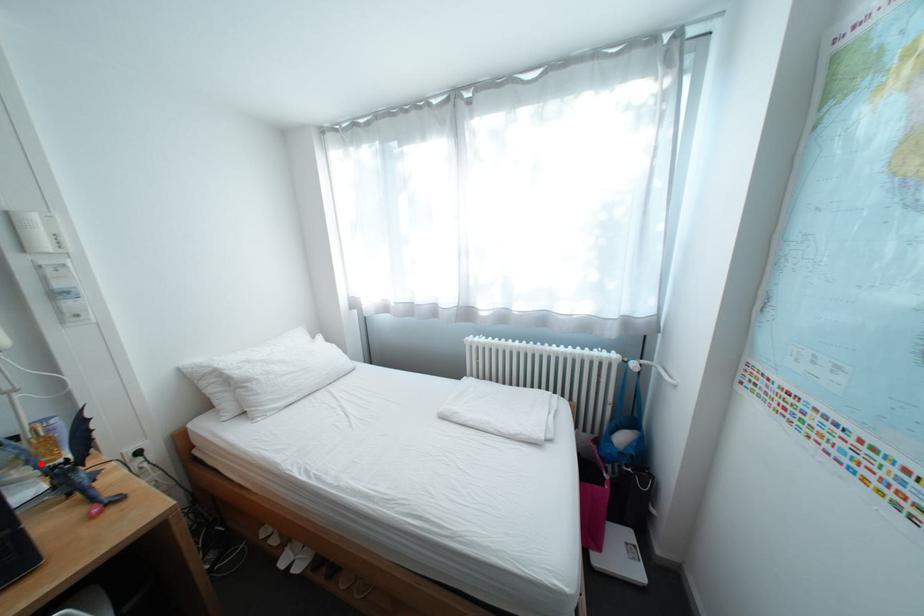
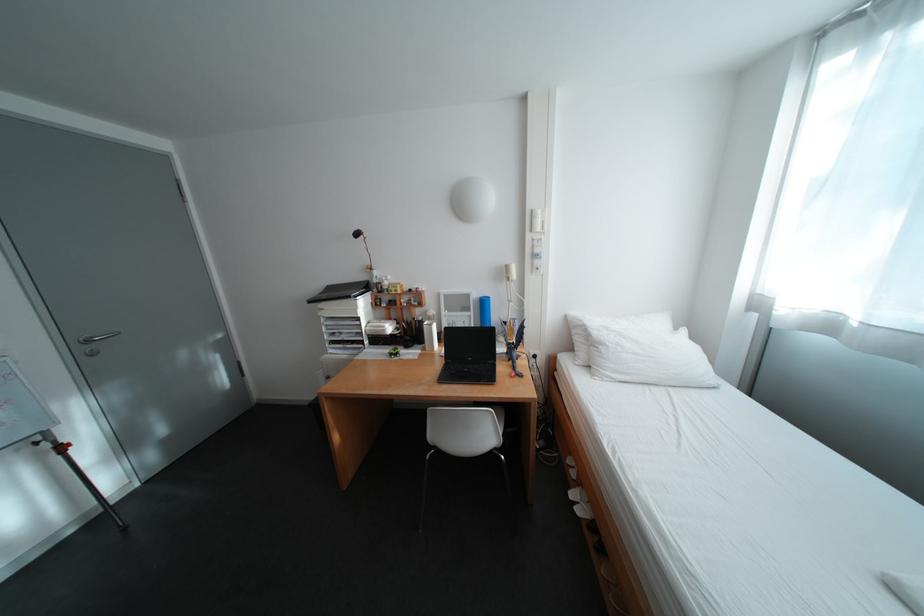
Question: I am providing you with two images of the same scene from different viewpoints. Given a red point in image1, look at the same physical point in image2. Is it:

Choices:
 (A) Closer to the viewpoint
 (B) Farther from the viewpoint

Answer: (B)